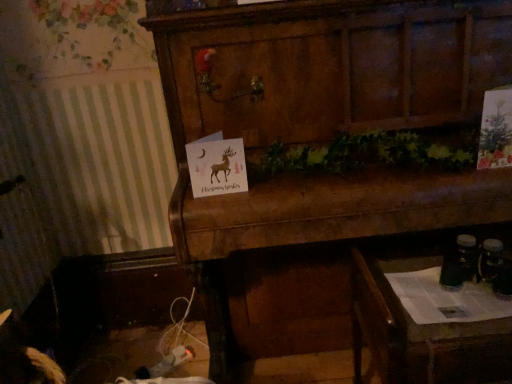
Question: Is wooden cabinet at center aimed at wooden drawer at lower right?

Choices:
 (A) yes
 (B) no

Answer: (A)

Question: Would you say wooden cabinet at center is a long distance from wooden drawer at lower right?

Choices:
 (A) yes
 (B) no

Answer: (B)

Question: Would you say wooden cabinet at center is outside wooden drawer at lower right?

Choices:
 (A) yes
 (B) no

Answer: (A)

Question: From a real-world perspective, is wooden cabinet at center on top of wooden drawer at lower right?

Choices:
 (A) yes
 (B) no

Answer: (A)

Question: Does wooden cabinet at center have a greater height compared to wooden drawer at lower right?

Choices:
 (A) no
 (B) yes

Answer: (B)

Question: From a real-world perspective, is wooden cabinet at center located beneath wooden drawer at lower right?

Choices:
 (A) no
 (B) yes

Answer: (A)

Question: Can you confirm if wooden drawer at lower right is smaller than wooden cabinet at center?

Choices:
 (A) no
 (B) yes

Answer: (B)

Question: Is wooden drawer at lower right located outside wooden cabinet at center?

Choices:
 (A) no
 (B) yes

Answer: (A)

Question: Can you confirm if wooden drawer at lower right is bigger than wooden cabinet at center?

Choices:
 (A) yes
 (B) no

Answer: (B)

Question: Is wooden drawer at lower right next to wooden cabinet at center?

Choices:
 (A) yes
 (B) no

Answer: (B)

Question: Is wooden cabinet at center a part of wooden drawer at lower right?

Choices:
 (A) no
 (B) yes

Answer: (A)

Question: Can you confirm if wooden drawer at lower right is shorter than wooden cabinet at center?

Choices:
 (A) yes
 (B) no

Answer: (A)

Question: Is wooden cabinet at center spatially inside wooden drawer at lower right, or outside of it?

Choices:
 (A) inside
 (B) outside

Answer: (B)